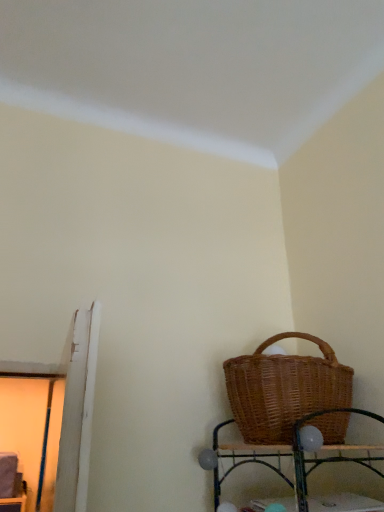
The image size is (384, 512). I want to click on woven brown picnic basket at lower right, so click(x=284, y=389).

Describe the element at coordinates (284, 389) in the screenshot. This screenshot has height=512, width=384. I see `woven brown picnic basket at lower right` at that location.

Based on the photo, in order to face woven brown picnic basket at lower right, should I rotate leftwards or rightwards?

To align with it, rotate right about 13.687°.

The height and width of the screenshot is (512, 384). Identify the location of woven brown picnic basket at lower right. (284, 389).